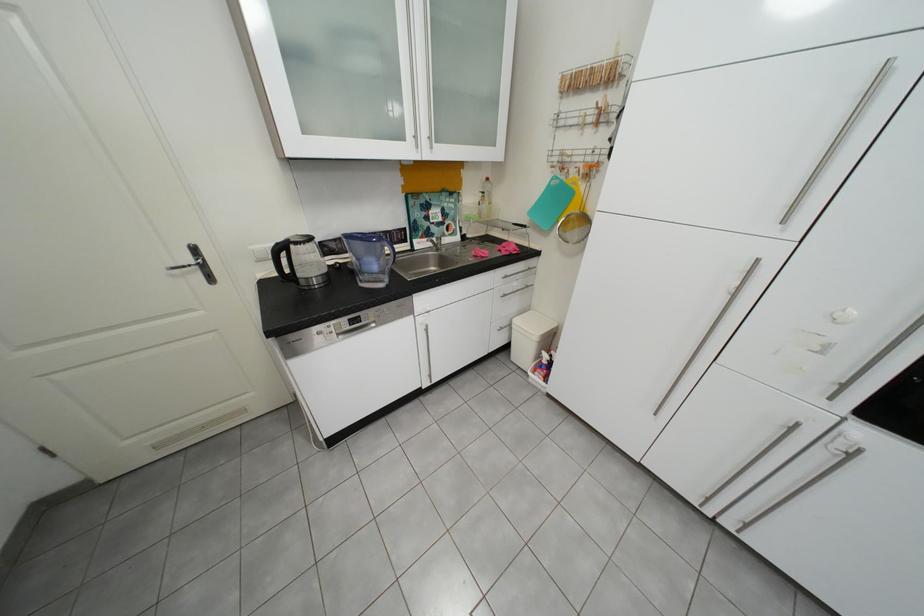
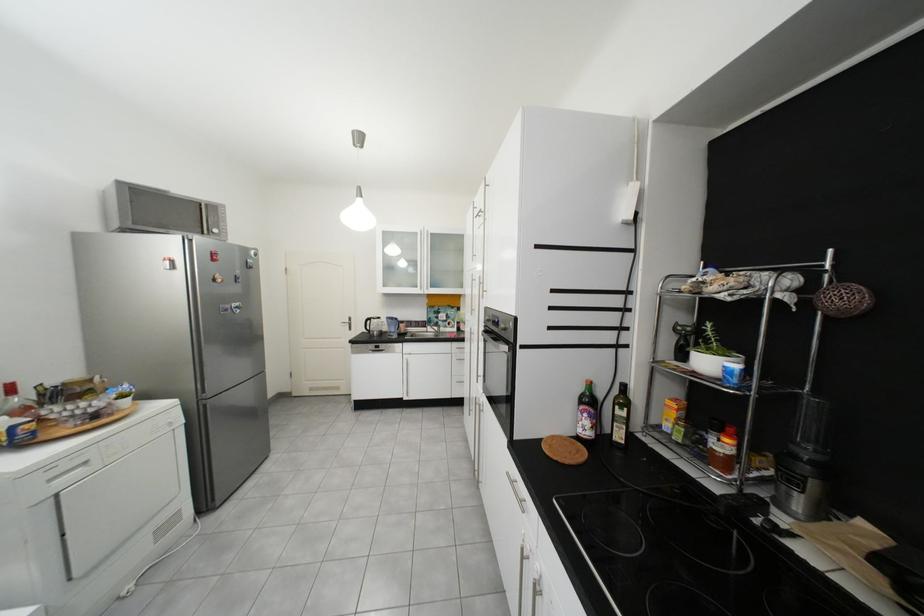
In the second image, find the point that corresponds to point 216,268 in the first image.

(361, 325)